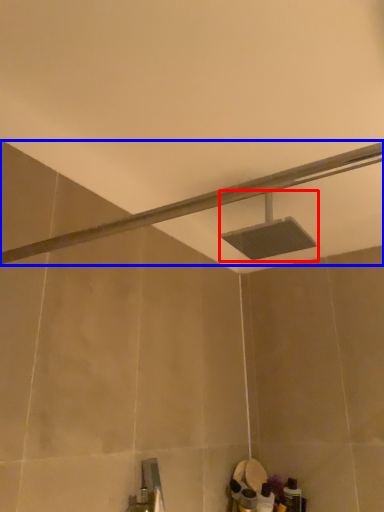
Question: Which of the following is the farthest to the observer, shower (highlighted by a red box) or shower (highlighted by a blue box)?

Choices:
 (A) shower
 (B) shower

Answer: (A)